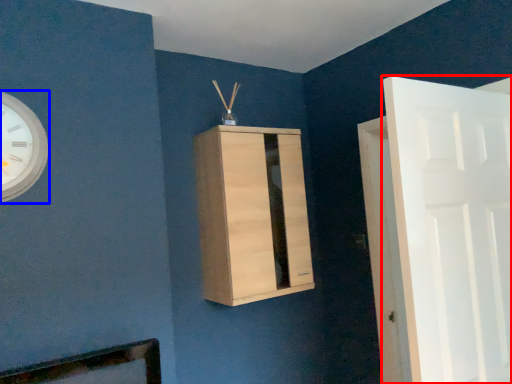
Question: Which object is further to the camera taking this photo, door (highlighted by a red box) or wall clock (highlighted by a blue box)?

Choices:
 (A) door
 (B) wall clock

Answer: (B)